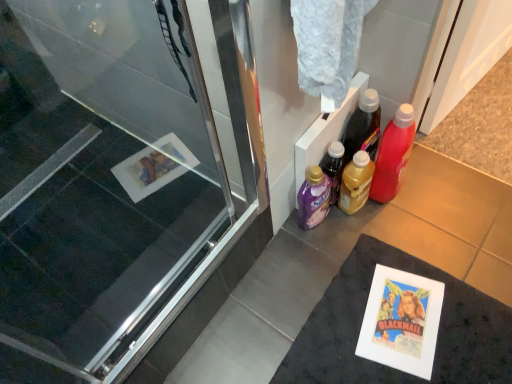
Question: Are transparent glass screen door at left and translucent plastic bottle at center-right, positioned as the 2th bottle in left-to-right order, far apart?

Choices:
 (A) yes
 (B) no

Answer: (B)

Question: Is transparent glass screen door at left positioned before translucent plastic bottle at center-right, arranged as the 2th bottle when viewed from the right?

Choices:
 (A) no
 (B) yes

Answer: (B)

Question: Does transparent glass screen door at left have a lesser height compared to translucent plastic bottle at center-right, positioned as the 2th bottle in left-to-right order?

Choices:
 (A) no
 (B) yes

Answer: (B)

Question: Can you confirm if transparent glass screen door at left is positioned to the right of translucent plastic bottle at center-right, positioned as the 2th bottle in left-to-right order?

Choices:
 (A) yes
 (B) no

Answer: (B)

Question: Is transparent glass screen door at left positioned with its back to translucent plastic bottle at center-right, positioned as the 2th bottle in left-to-right order?

Choices:
 (A) yes
 (B) no

Answer: (B)

Question: Based on their positions, is purple plastic bottle at lower center, acting as the first bottle starting from the left, located to the left or right of translucent plastic bottle at center-right, arranged as the 2th bottle when viewed from the right?

Choices:
 (A) left
 (B) right

Answer: (A)

Question: Is purple plastic bottle at lower center, acting as the first bottle starting from the left, inside the boundaries of translucent plastic bottle at center-right, positioned as the 2th bottle in left-to-right order, or outside?

Choices:
 (A) inside
 (B) outside

Answer: (B)

Question: Considering the positions of purple plastic bottle at lower center, which is the third bottle in right-to-left order, and translucent plastic bottle at center-right, arranged as the 2th bottle when viewed from the right, in the image, is purple plastic bottle at lower center, which is the third bottle in right-to-left order, taller or shorter than translucent plastic bottle at center-right, arranged as the 2th bottle when viewed from the right,?

Choices:
 (A) short
 (B) tall

Answer: (B)

Question: Looking at their shapes, would you say purple plastic bottle at lower center, which is the third bottle in right-to-left order, is wider or thinner than translucent plastic bottle at center-right, positioned as the 2th bottle in left-to-right order?

Choices:
 (A) thin
 (B) wide

Answer: (A)

Question: Considering the positions of translucent plastic bottle at right, the 3th bottle when ordered from left to right, and translucent plastic bottle at center-right, positioned as the 2th bottle in left-to-right order, in the image, is translucent plastic bottle at right, the 3th bottle when ordered from left to right, taller or shorter than translucent plastic bottle at center-right, positioned as the 2th bottle in left-to-right order,?

Choices:
 (A) short
 (B) tall

Answer: (B)

Question: Relative to translucent plastic bottle at center-right, positioned as the 2th bottle in left-to-right order, is translucent plastic bottle at right, which is the 1th bottle in right-to-left order, in front or behind?

Choices:
 (A) front
 (B) behind

Answer: (A)

Question: Based on their positions, is translucent plastic bottle at right, which is the 1th bottle in right-to-left order, located to the left or right of translucent plastic bottle at center-right, positioned as the 2th bottle in left-to-right order?

Choices:
 (A) right
 (B) left

Answer: (A)

Question: Is translucent plastic bottle at right, which is the 1th bottle in right-to-left order, situated inside translucent plastic bottle at center-right, positioned as the 2th bottle in left-to-right order, or outside?

Choices:
 (A) inside
 (B) outside

Answer: (B)

Question: From a real-world perspective, relative to purple plastic bottle at lower center, which is the third bottle in right-to-left order, is transparent glass screen door at left vertically above or below?

Choices:
 (A) below
 (B) above

Answer: (B)

Question: Would you say transparent glass screen door at left is to the left or to the right of purple plastic bottle at lower center, acting as the first bottle starting from the left, in the picture?

Choices:
 (A) left
 (B) right

Answer: (A)